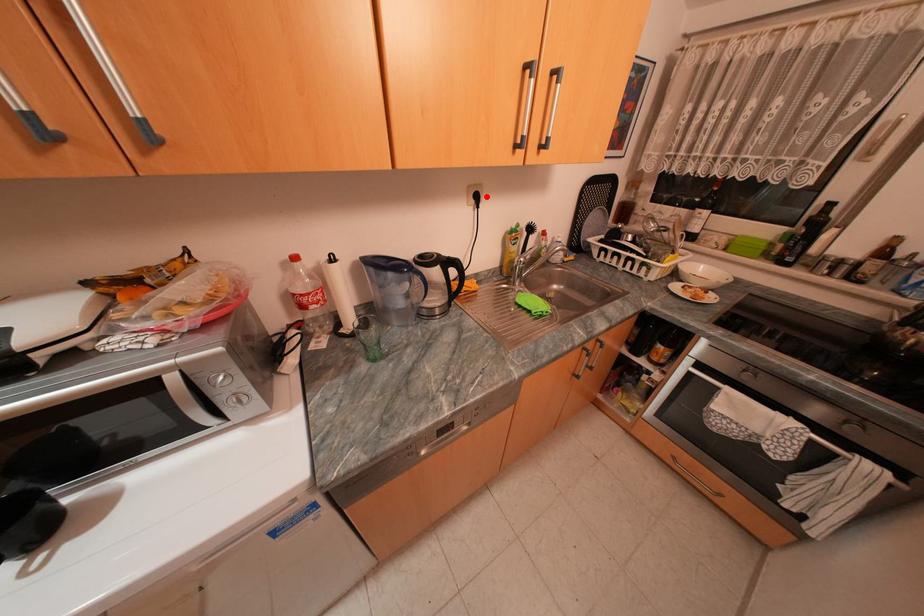
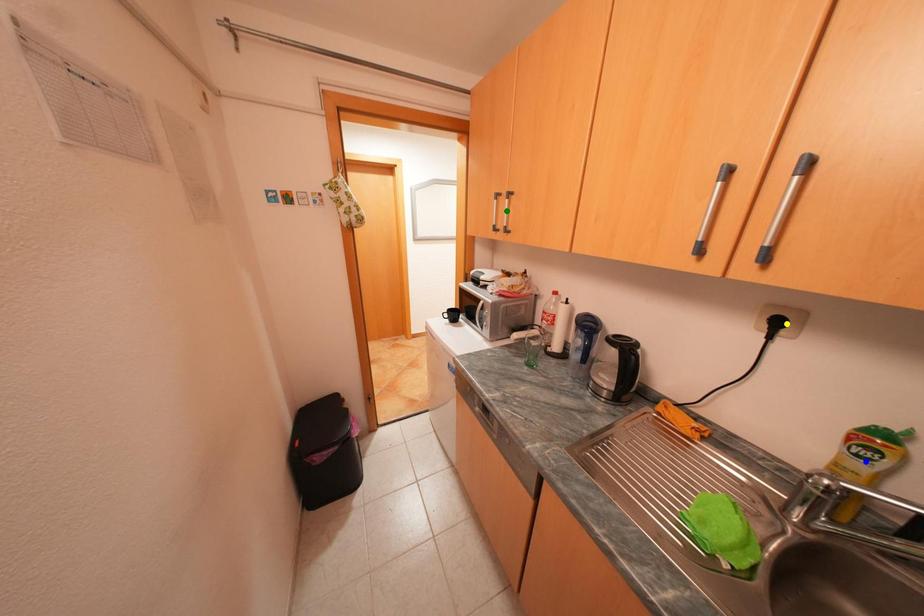
Question: I am providing you with two images of the same scene from different viewpoints. A red point is marked on the first image. You are given multiple points on the second image. Which mark in image 2 goes with the point in image 1?

Choices:
 (A) green point
 (B) blue point
 (C) yellow point

Answer: (C)